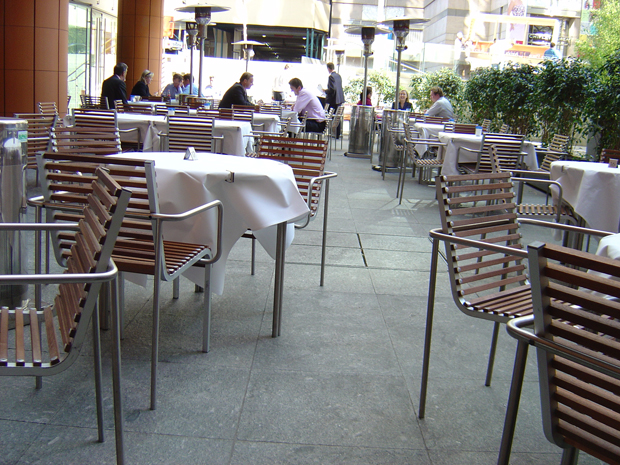
This screenshot has width=620, height=465. In order to click on white tablecloth in this screenshot , I will do `click(608, 247)`, `click(596, 183)`, `click(466, 139)`, `click(425, 128)`, `click(412, 118)`, `click(268, 116)`, `click(293, 111)`, `click(234, 129)`, `click(226, 182)`.